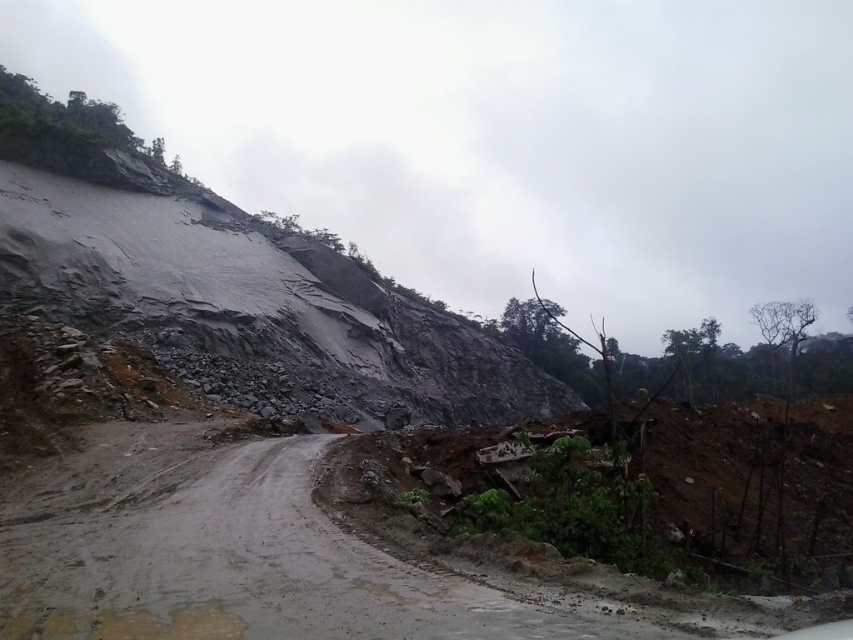
You are a hiker planning to cross the muddy concrete dirt track at center. There is a gray rock at upper left nearby. Which object is higher in elevation?

The gray rock at upper left is higher in elevation than the muddy concrete dirt track at center.

You are a hiker planning to cross the muddy concrete dirt track at center and the gray rock at upper left. Which path is narrower and therefore more challenging for your equipment?

The muddy concrete dirt track at center is thinner than the gray rock at upper left, making it the narrower path and thus more challenging for your equipment.